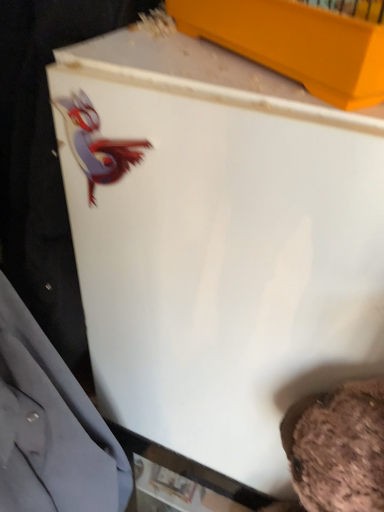
The width and height of the screenshot is (384, 512). What do you see at coordinates (299, 42) in the screenshot?
I see `matte yellow box at upper center` at bounding box center [299, 42].

What are the coordinates of `matte yellow box at upper center` in the screenshot? It's located at (299, 42).

In order to face matte gray dress shirt at left, should I rotate leftwards or rightwards?

To align with it, rotate left about 18.303°.

Describe the element at coordinates (50, 426) in the screenshot. The image size is (384, 512). I see `matte gray dress shirt at left` at that location.

I want to click on matte gray dress shirt at left, so click(x=50, y=426).

Measure the distance between point (43,490) and camera.

Point (43,490) is 23.31 inches from camera.

You are a GUI agent. You are given a task and a screenshot of the screen. Output one action in this format:
    pyautogui.click(x=<x>, y=<y>)
    Task: Click on the matte yellow box at upper center
    Image resolution: width=384 pixels, height=512 pixels.
    Given the screenshot: What is the action you would take?
    pyautogui.click(x=299, y=42)

Does matte yellow box at upper center appear on the left side of matte gray dress shirt at left?

Incorrect, matte yellow box at upper center is not on the left side of matte gray dress shirt at left.

Who is more distant, matte yellow box at upper center or matte gray dress shirt at left?

matte yellow box at upper center is behind.

Between point (215, 3) and point (74, 379), which one is positioned behind?

The point (74, 379) is behind.

From the image's perspective, is matte yellow box at upper center located above or below matte gray dress shirt at left?

From the image's perspective, matte yellow box at upper center appears above matte gray dress shirt at left.

From a real-world perspective, is matte yellow box at upper center above or below matte gray dress shirt at left?

From a real-world perspective, matte yellow box at upper center is physically above matte gray dress shirt at left.

Looking at their sizes, would you say matte yellow box at upper center is wider or thinner than matte gray dress shirt at left?

matte yellow box at upper center is wider than matte gray dress shirt at left.

Is matte yellow box at upper center taller or shorter than matte gray dress shirt at left?

Clearly, matte yellow box at upper center is shorter compared to matte gray dress shirt at left.

Looking at this image, based on their sizes in the image, would you say matte yellow box at upper center is bigger or smaller than matte gray dress shirt at left?

Considering their sizes, matte yellow box at upper center takes up less space than matte gray dress shirt at left.

Is matte yellow box at upper center not inside matte gray dress shirt at left?

matte yellow box at upper center lies outside matte gray dress shirt at left's area.

Is matte yellow box at upper center placed right next to matte gray dress shirt at left?

No.

Based on the photo, is matte yellow box at upper center positioned with its back to matte gray dress shirt at left?

That's not correct — matte yellow box at upper center is not looking away from matte gray dress shirt at left.

How much distance is there between matte yellow box at upper center and matte gray dress shirt at left?

matte yellow box at upper center and matte gray dress shirt at left are 19.00 inches apart from each other.

I want to click on box that appears above the matte gray dress shirt at left (from a real-world perspective), so click(x=299, y=42).

Is matte gray dress shirt at left at the right side of matte yellow box at upper center?

No.

Is the position of matte gray dress shirt at left less distant than that of matte yellow box at upper center?

Yes, matte gray dress shirt at left is closer to the camera.

Is point (52, 482) closer or farther from the camera than point (286, 8)?

Point (52, 482).

From the image's perspective, which one is positioned lower, matte gray dress shirt at left or matte yellow box at upper center?

matte gray dress shirt at left is shown below in the image.

From a real-world perspective, which object stands above the other?

matte yellow box at upper center is physically above.

Considering the relative sizes of matte gray dress shirt at left and matte yellow box at upper center in the image provided, is matte gray dress shirt at left wider than matte yellow box at upper center?

Incorrect, the width of matte gray dress shirt at left does not surpass that of matte yellow box at upper center.

Which of these two, matte gray dress shirt at left or matte yellow box at upper center, stands taller?

Standing taller between the two is matte gray dress shirt at left.

Considering the relative sizes of matte gray dress shirt at left and matte yellow box at upper center in the image provided, is matte gray dress shirt at left smaller than matte yellow box at upper center?

Incorrect, matte gray dress shirt at left is not smaller in size than matte yellow box at upper center.

Can we say matte gray dress shirt at left lies outside matte yellow box at upper center?

Indeed, matte gray dress shirt at left is completely outside matte yellow box at upper center.

Is there a large distance between matte gray dress shirt at left and matte yellow box at upper center?

Actually, matte gray dress shirt at left and matte yellow box at upper center are a little close together.

Does matte gray dress shirt at left turn towards matte yellow box at upper center?

No, matte gray dress shirt at left is not aimed at matte yellow box at upper center.

What's the angular difference between matte gray dress shirt at left and matte yellow box at upper center's facing directions?

The angle between the facing direction of matte gray dress shirt at left and the facing direction of matte yellow box at upper center is 36.5 degrees.

The width and height of the screenshot is (384, 512). Find the location of `dress shirt in front of the matte yellow box at upper center`. dress shirt in front of the matte yellow box at upper center is located at coordinates (50, 426).

The width and height of the screenshot is (384, 512). In the image, there is a matte gray dress shirt at left. Identify the location of box above it (from the image's perspective). (299, 42).

You are a GUI agent. You are given a task and a screenshot of the screen. Output one action in this format:
    pyautogui.click(x=<x>, y=<y>)
    Task: Click on the box to the right of matte gray dress shirt at left
    This screenshot has width=384, height=512.
    Given the screenshot: What is the action you would take?
    pyautogui.click(x=299, y=42)